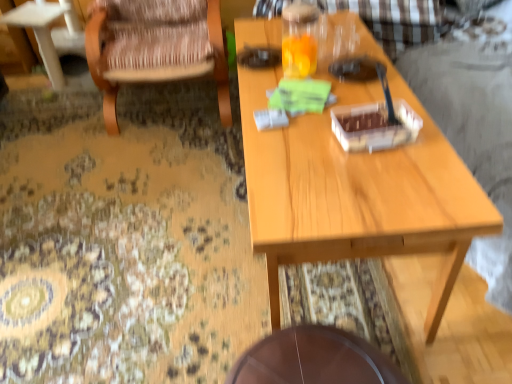
The height and width of the screenshot is (384, 512). Identify the location of vacant area on top of light wood table at center (from a real-world perspective). (327, 112).